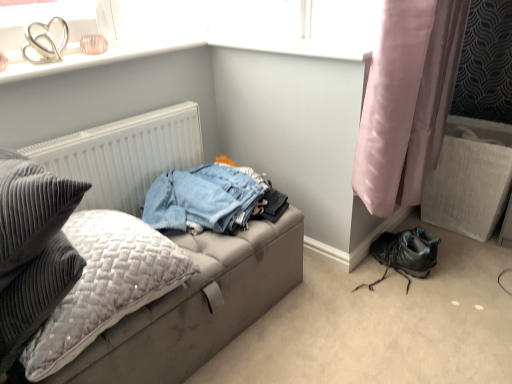
The image size is (512, 384). Find the location of `free space in front of matte black shoe at lower right`. free space in front of matte black shoe at lower right is located at coordinates (403, 327).